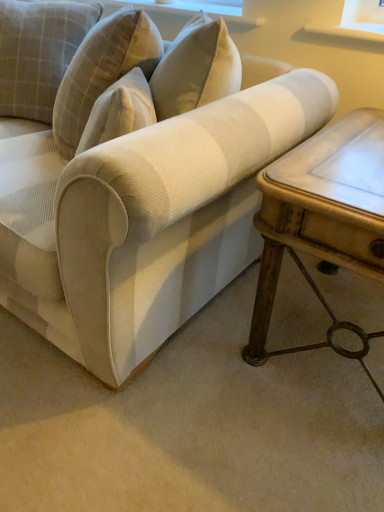
The height and width of the screenshot is (512, 384). I want to click on empty space that is ontop of white marble table at right (from a real-world perspective), so click(x=352, y=152).